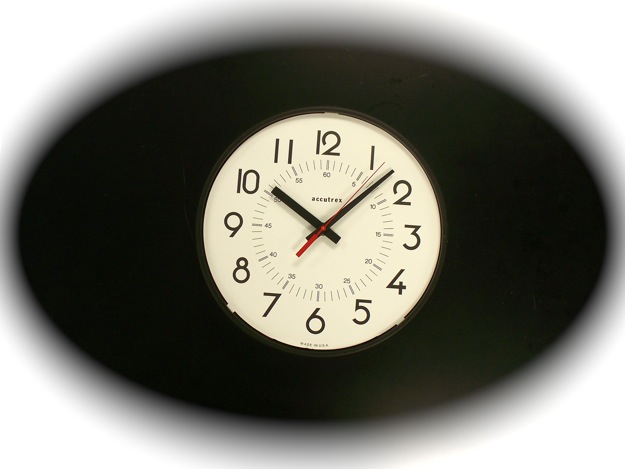
The height and width of the screenshot is (469, 625). Identify the location of clock. (321, 209).